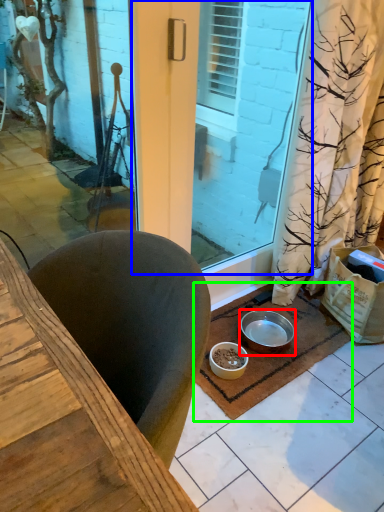
Question: Estimate the real-world distances between objects in this image. Which object is closer to bowl (highlighted by a red box), screen door (highlighted by a blue box) or doormat (highlighted by a green box)?

Choices:
 (A) screen door
 (B) doormat

Answer: (B)